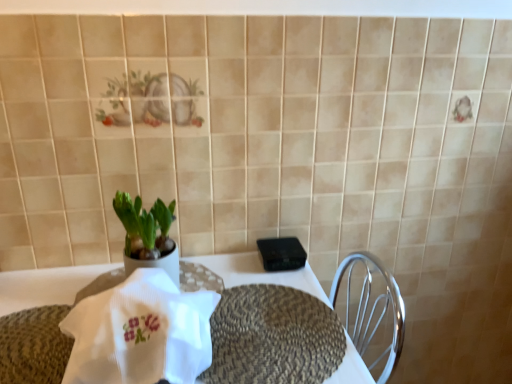
This screenshot has height=384, width=512. What do you see at coordinates (273, 337) in the screenshot? I see `braided woven placemat at center` at bounding box center [273, 337].

Locate an element on the screen. Image resolution: width=512 pixels, height=384 pixels. green matte plant at center is located at coordinates (147, 235).

Measure the distance between green matte plant at center and camera.

A distance of 97.35 centimeters exists between green matte plant at center and camera.

Identify the location of white woven placemat at center. Image resolution: width=512 pixels, height=384 pixels. (46, 285).

Identify the location of braided woven placemat at center. The height and width of the screenshot is (384, 512). (273, 337).

Is black plastic device at center shorter than white woven placemat at center?

Indeed, black plastic device at center has a lesser height compared to white woven placemat at center.

From a real-world perspective, is black plastic device at center physically below white woven placemat at center?

No, from a real-world perspective, black plastic device at center is not beneath white woven placemat at center.

Which object is positioned more to the right, black plastic device at center or white woven placemat at center?

Positioned to the right is black plastic device at center.

From the image's perspective, relative to white woven placemat at center, is black plastic device at center above or below?

From the image's perspective, black plastic device at center appears above white woven placemat at center.

From the image's perspective, which object appears higher, white ribbed cloth at center or green matte plant at center?

green matte plant at center appears higher in the image.

In the scene shown: Is white ribbed cloth at center thinner than green matte plant at center?

In fact, white ribbed cloth at center might be wider than green matte plant at center.

How many degrees apart are the facing directions of white ribbed cloth at center and green matte plant at center?

0.000257 degrees.

Looking at this image, in the image, is white ribbed cloth at center on the left side or the right side of green matte plant at center?

From the image, it's evident that white ribbed cloth at center is to the right of green matte plant at center.

Is white woven placemat at center smaller than green matte plant at center?

Incorrect, white woven placemat at center is not smaller in size than green matte plant at center.

Is white woven placemat at center shorter than green matte plant at center?

Incorrect, the height of white woven placemat at center does not fall short of that of green matte plant at center.

Is point (72, 297) farther from viewer compared to point (123, 197)?

Yes.

From the image's perspective, would you say white woven placemat at center is positioned over green matte plant at center?

Actually, white woven placemat at center appears below green matte plant at center in the image.

Would you say braided woven placemat at center is part of black plastic device at center's contents?

No, braided woven placemat at center is not inside black plastic device at center.

Based on their sizes in the image, would you say black plastic device at center is bigger or smaller than braided woven placemat at center?

black plastic device at center is smaller than braided woven placemat at center.

Is the depth of black plastic device at center less than that of braided woven placemat at center?

No, it is behind braided woven placemat at center.

In the image, is black plastic device at center on the left side or the right side of braided woven placemat at center?

black plastic device at center is to the right of braided woven placemat at center.

Between braided woven placemat at center and white woven placemat at center, which one appears on the right side from the viewer's perspective?

braided woven placemat at center is more to the right.

Is braided woven placemat at center next to white woven placemat at center and touching it?

braided woven placemat at center and white woven placemat at center are not in contact.

Is braided woven placemat at center positioned with its back to white woven placemat at center?

Absolutely, braided woven placemat at center is directed away from white woven placemat at center.

Is braided woven placemat at center not within black plastic device at center?

Absolutely, braided woven placemat at center is external to black plastic device at center.

From the image's perspective, does braided woven placemat at center appear higher than black plastic device at center?

Actually, braided woven placemat at center appears below black plastic device at center in the image.

Considering the sizes of objects braided woven placemat at center and black plastic device at center in the image provided, who is thinner, braided woven placemat at center or black plastic device at center?

Thinner between the two is black plastic device at center.

Is point (127, 354) closer or farther from the camera than point (266, 368)?

Clearly, point (127, 354) is closer to the camera than point (266, 368).

Is white ribbed cloth at center far away from braided woven placemat at center?

white ribbed cloth at center is actually quite close to braided woven placemat at center.

Image resolution: width=512 pixels, height=384 pixels. Identify the location of cloth above the braided woven placemat at center (from a real-world perspective). (140, 332).

Find the location of a particular element. The height and width of the screenshot is (384, 512). tableware that appears on the right of white woven placemat at center is located at coordinates (281, 253).

At what (x,y) coordinates should I click in order to perform the action: click on houseplant above the white ribbed cloth at center (from a real-world perspective). Please return your answer as a coordinate pair (x, y). This screenshot has height=384, width=512. Looking at the image, I should click on (147, 235).

Considering their positions, is green matte plant at center positioned further to white woven placemat at center than braided woven placemat at center?

green matte plant at center is positioned further to the anchor white woven placemat at center.

Estimate the real-world distances between objects in this image. Which object is further from braided woven placemat at center, green matte plant at center or black plastic device at center?

green matte plant at center.

Based on their spatial positions, is braided woven placemat at center or green matte plant at center closer to white ribbed cloth at center?

braided woven placemat at center lies closer to white ribbed cloth at center than the other object.

From the image, which object appears to be nearer to black plastic device at center, white ribbed cloth at center or green matte plant at center?

The object closer to black plastic device at center is green matte plant at center.

Considering their positions, is braided woven placemat at center positioned further to black plastic device at center than white woven placemat at center?

braided woven placemat at center.

Looking at the image, which one is located closer to white ribbed cloth at center, green matte plant at center or braided woven placemat at center?

braided woven placemat at center.

Based on their spatial positions, is braided woven placemat at center or green matte plant at center closer to white woven placemat at center?

braided woven placemat at center lies closer to white woven placemat at center than the other object.

Looking at this image, from the image, which object appears to be nearer to green matte plant at center, white woven placemat at center or black plastic device at center?

white woven placemat at center.

At what (x,y) coordinates should I click in order to perform the action: click on table between white ribbed cloth at center and black plastic device at center from front to back. Please return your answer as a coordinate pair (x, y). Looking at the image, I should click on (46, 285).

Image resolution: width=512 pixels, height=384 pixels. Identify the location of place mat between white woven placemat at center and black plastic device at center in the front-back direction. (273, 337).

Where is `houseplant located between white woven placemat at center and black plastic device at center in the depth direction`? Image resolution: width=512 pixels, height=384 pixels. houseplant located between white woven placemat at center and black plastic device at center in the depth direction is located at coordinates (147, 235).

Locate an element on the screen. This screenshot has width=512, height=384. houseplant located between braided woven placemat at center and black plastic device at center in the depth direction is located at coordinates (147, 235).